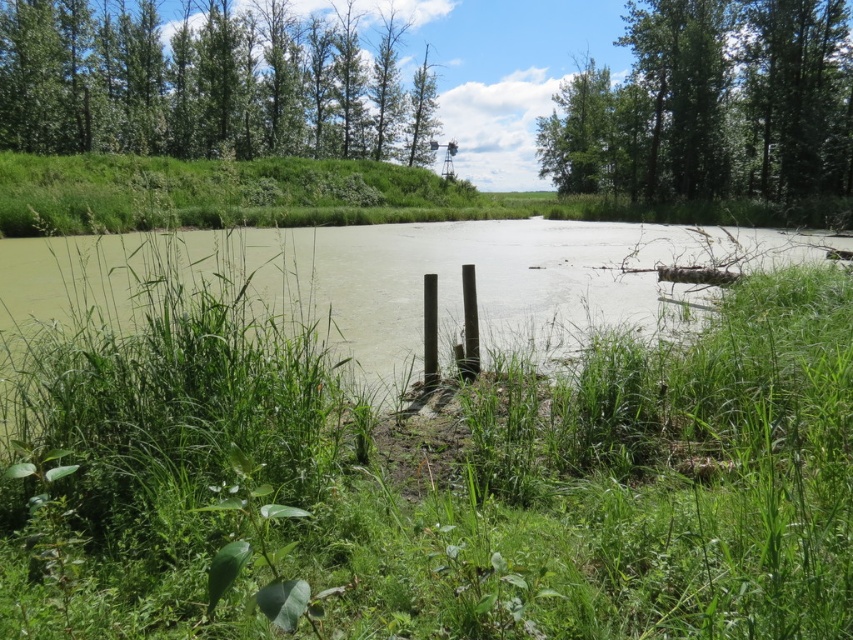
You are standing at the edge of the pond and want to cross to the other side. The green grass at center and green leafy trees at upper center are in your path. Which object is narrower so you can walk through it more easily?

The green grass at center has a width less than green leafy trees at upper center, so it is narrower and easier to walk through.

You are an environmental scientist assessing the canopy coverage of the area. Which of the two trees, the green leafy trees at upper center or the green leafy tree at upper right, is closer to the ground level?

The green leafy trees at upper center is positioned under the green leafy tree at upper right, meaning it is closer to the ground level.

You are standing at the edge of the pond and want to take a photo of the green leafy trees at upper center and the green leafy tree at upper right. Which tree will appear closer to the camera in your photo?

The green leafy trees at upper center will appear closer to the camera because it is positioned in front of the green leafy tree at upper right.